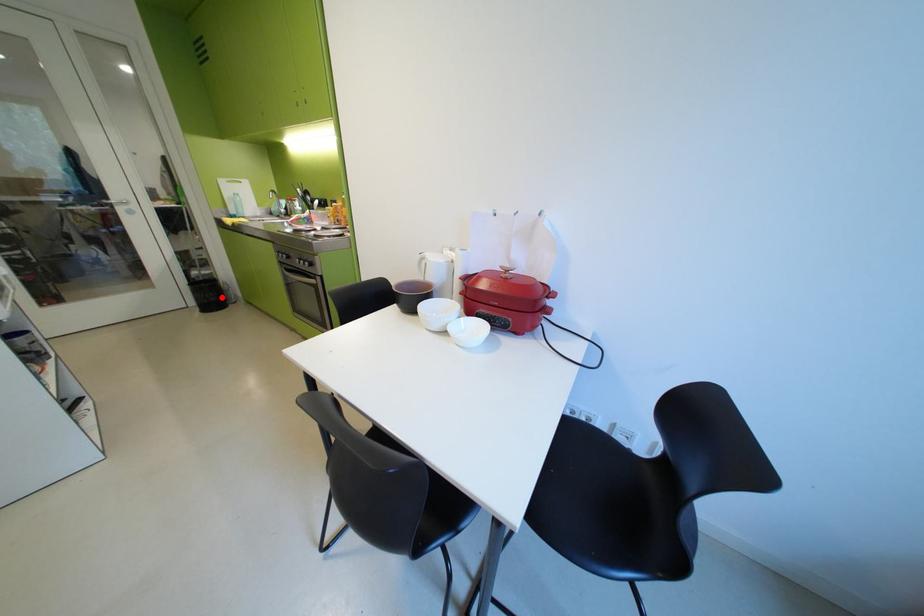
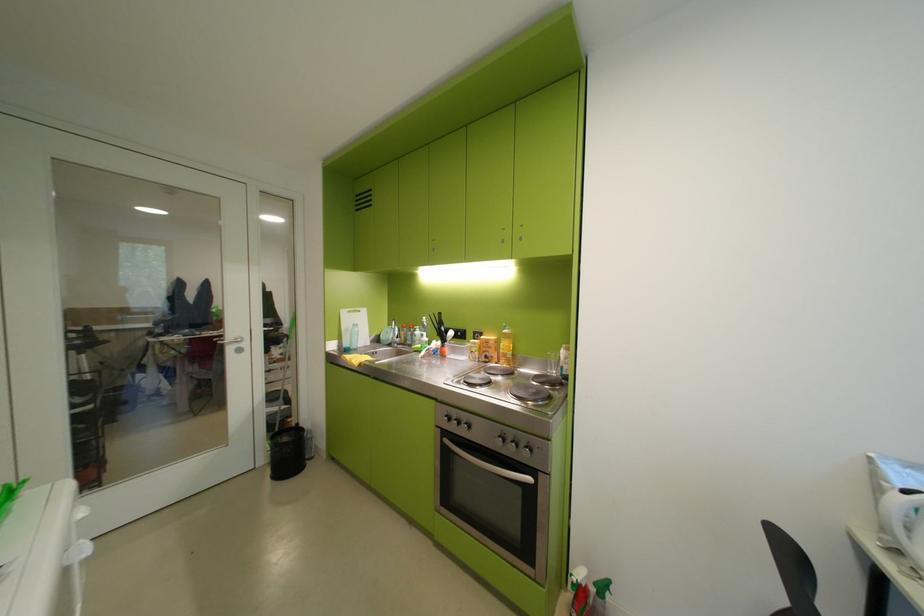
The point at the highlighted location is marked in the first image. Where is the corresponding point in the second image?

(299, 453)